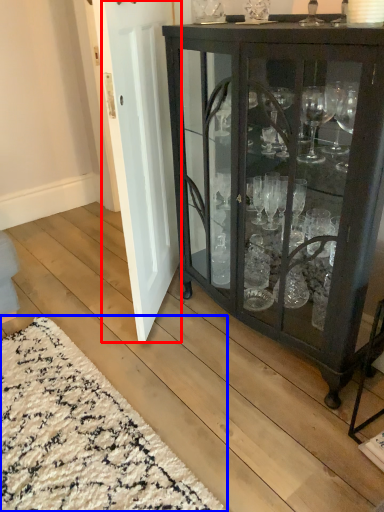
Question: Which object is closer to the camera taking this photo, door (highlighted by a red box) or doormat (highlighted by a blue box)?

Choices:
 (A) door
 (B) doormat

Answer: (B)